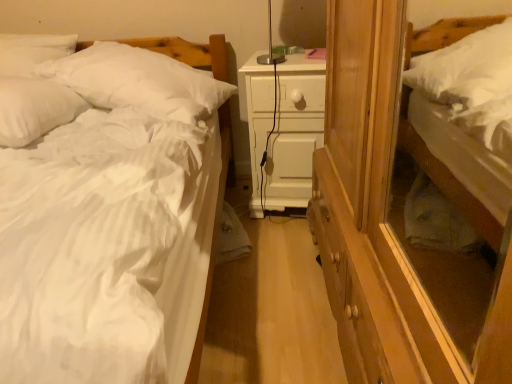
Question: Does white soft bed at right, marked as the 2th bed in a left-to-right arrangement, have a smaller size compared to white soft pillow at left, which ranks as the 1th pillow in left-to-right order?

Choices:
 (A) yes
 (B) no

Answer: (B)

Question: From the image's perspective, is white soft bed at right, marked as the 2th bed in a left-to-right arrangement, beneath white soft pillow at left, the second pillow viewed from the right?

Choices:
 (A) no
 (B) yes

Answer: (A)

Question: Could you tell me if white soft bed at right, marked as the 2th bed in a left-to-right arrangement, is turned towards white soft pillow at left, which ranks as the 1th pillow in left-to-right order?

Choices:
 (A) no
 (B) yes

Answer: (B)

Question: Is white soft bed at right, which is counted as the 1th bed, starting from the right, far from white soft pillow at left, which ranks as the 1th pillow in left-to-right order?

Choices:
 (A) yes
 (B) no

Answer: (A)

Question: Can you confirm if white soft bed at right, which is counted as the 1th bed, starting from the right, is positioned to the right of white soft pillow at left, the second pillow viewed from the right?

Choices:
 (A) no
 (B) yes

Answer: (B)

Question: Does white soft bed at right, which is counted as the 1th bed, starting from the right, have a larger size compared to white soft pillow at left, the second pillow viewed from the right?

Choices:
 (A) no
 (B) yes

Answer: (B)

Question: Is white soft pillow at upper left, which is the second pillow in left-to-right order, bigger than white soft bed at right, marked as the 2th bed in a left-to-right arrangement?

Choices:
 (A) no
 (B) yes

Answer: (B)

Question: Does white soft pillow at upper left, placed as the first pillow when sorted from right to left, appear on the right side of white soft bed at right, marked as the 2th bed in a left-to-right arrangement?

Choices:
 (A) no
 (B) yes

Answer: (A)

Question: Can you confirm if white soft pillow at upper left, placed as the first pillow when sorted from right to left, is taller than white soft bed at right, which is counted as the 1th bed, starting from the right?

Choices:
 (A) yes
 (B) no

Answer: (B)

Question: Is white soft pillow at upper left, placed as the first pillow when sorted from right to left, looking in the opposite direction of white soft bed at right, marked as the 2th bed in a left-to-right arrangement?

Choices:
 (A) yes
 (B) no

Answer: (B)

Question: From a real-world perspective, is white soft pillow at upper left, which is the second pillow in left-to-right order, located higher than white soft bed at right, marked as the 2th bed in a left-to-right arrangement?

Choices:
 (A) no
 (B) yes

Answer: (B)

Question: Is white soft pillow at upper left, which is the second pillow in left-to-right order, directly adjacent to white soft bed at right, which is counted as the 1th bed, starting from the right?

Choices:
 (A) yes
 (B) no

Answer: (B)

Question: Is white soft bed at right, marked as the 2th bed in a left-to-right arrangement, facing towards white soft pillow at upper left, which is the second pillow in left-to-right order?

Choices:
 (A) yes
 (B) no

Answer: (A)